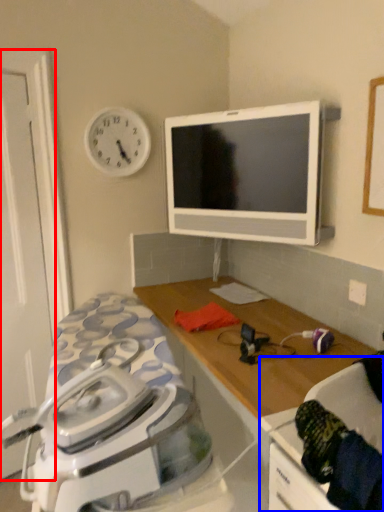
Question: Which of the following is the farthest to the observer, door (highlighted by a red box) or swivel chair (highlighted by a blue box)?

Choices:
 (A) door
 (B) swivel chair

Answer: (A)